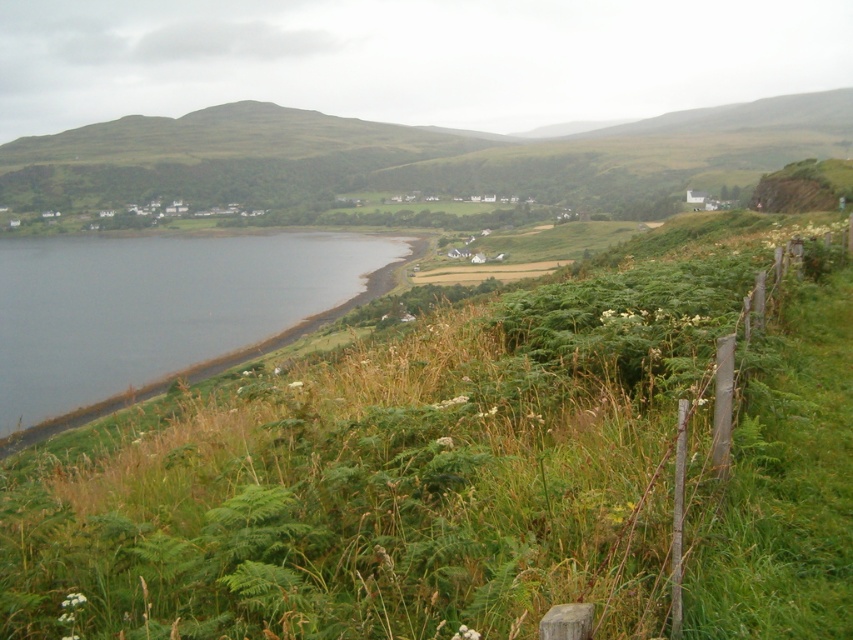
Question: Can you confirm if dark gray water at lower left is positioned below wooden post fence at right?

Choices:
 (A) no
 (B) yes

Answer: (A)

Question: Which object is positioned closest to the dark gray water at lower left?

Choices:
 (A) green grassy at lower left
 (B) wooden post fence at right

Answer: (A)

Question: Is green grassy at lower left thinner than wooden post fence at right?

Choices:
 (A) no
 (B) yes

Answer: (A)

Question: Is green grassy at lower left bigger than dark gray water at lower left?

Choices:
 (A) no
 (B) yes

Answer: (A)

Question: Which of the following is the farthest from the observer?

Choices:
 (A) dark gray water at lower left
 (B) green grassy at lower left
 (C) wooden post fence at right

Answer: (A)

Question: Considering the real-world distances, which object is farthest from the dark gray water at lower left?

Choices:
 (A) wooden post fence at right
 (B) green grassy at lower left

Answer: (A)